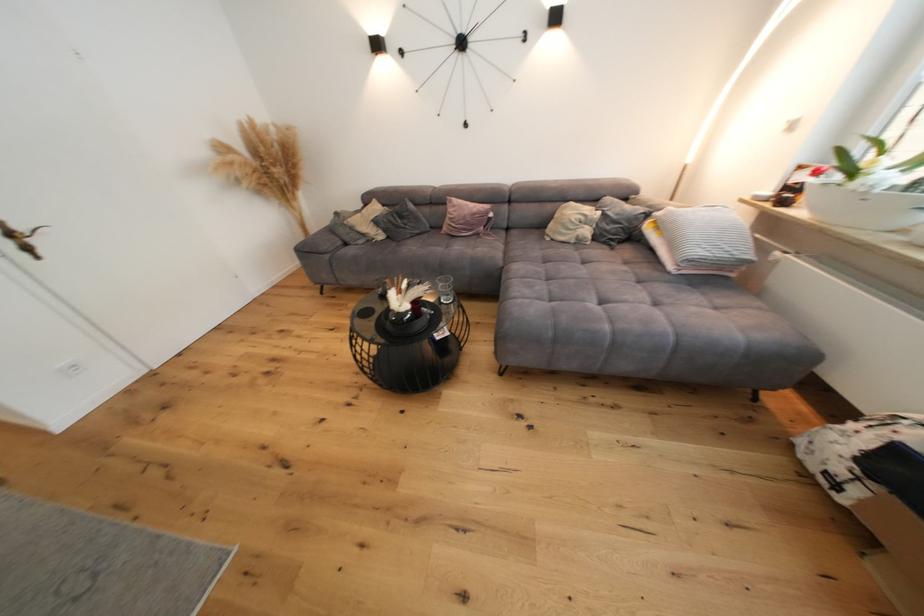
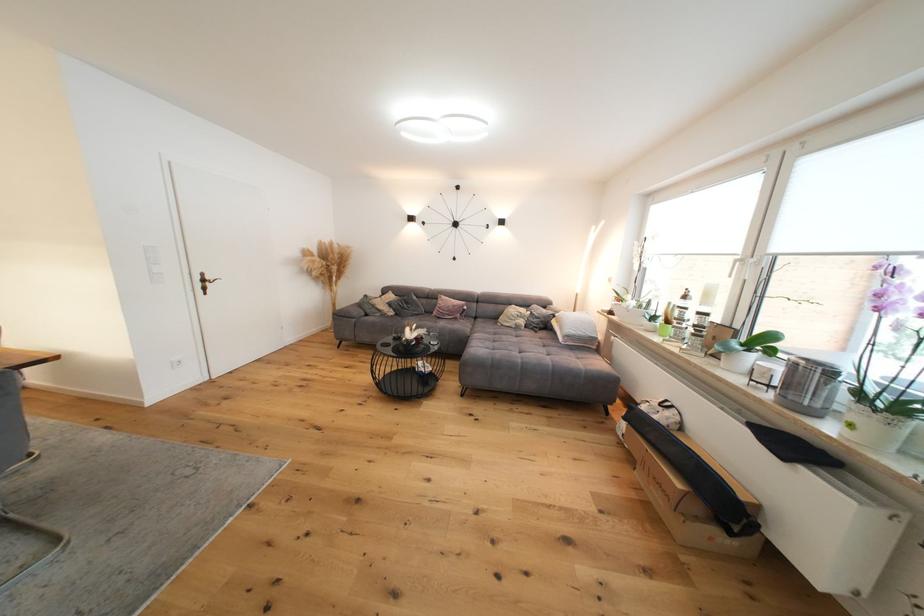
Question: The images are taken continuously from a first-person perspective. In which direction are you moving?

Choices:
 (A) Left
 (B) Right
 (C) Forward
 (D) Backward

Answer: (D)